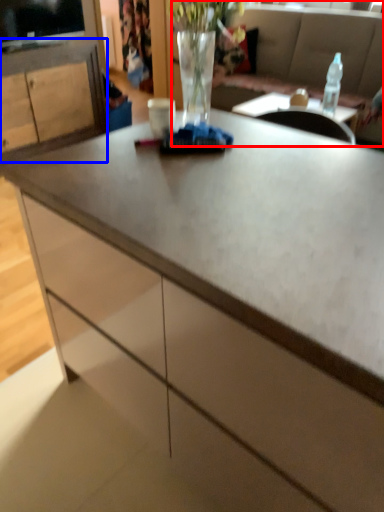
Question: Among these objects, which one is nearest to the camera, studio couch (highlighted by a red box) or cabinetry (highlighted by a blue box)?

Choices:
 (A) studio couch
 (B) cabinetry

Answer: (A)